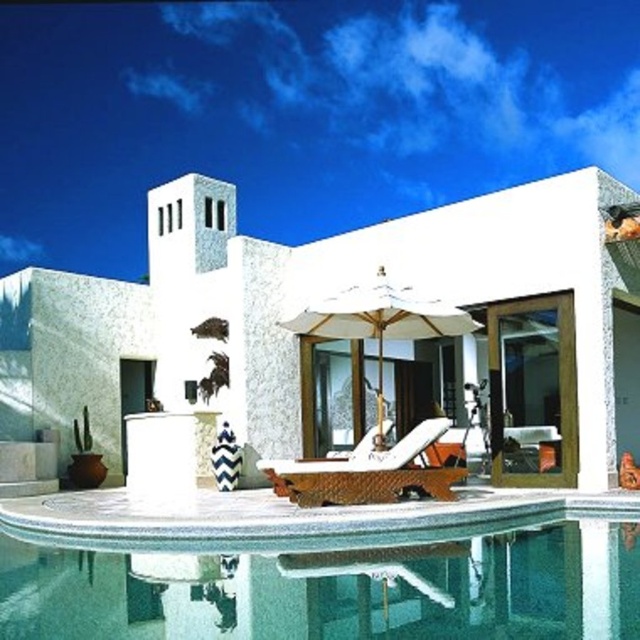
You are designing a layout for a poolside area and need to place a new table between the clear glass pool at lower center and the white fabric umbrella at center. Given their sizes, which object should the table be closer to?

The table should be placed closer to the clear glass pool at lower center because it occupies less space than the white fabric umbrella at center, allowing more room around the larger umbrella area.

You are planning to place a new 10 feet long bench by the pool. The bench needs to be placed between the clear glass pool at lower center and the white fabric umbrella at center. Is there enough space between them to fit the bench?

The distance between the clear glass pool at lower center and the white fabric umbrella at center is 12.73 feet, which is more than the 10 feet length of the bench. Therefore, there is enough space to place the bench between them.